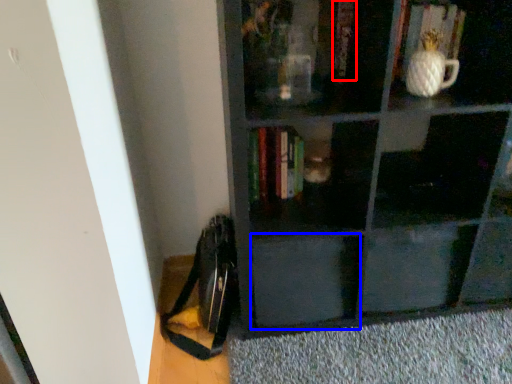
Question: Among these objects, which one is nearest to the camera, book (highlighted by a red box) or drawer (highlighted by a blue box)?

Choices:
 (A) book
 (B) drawer

Answer: (A)